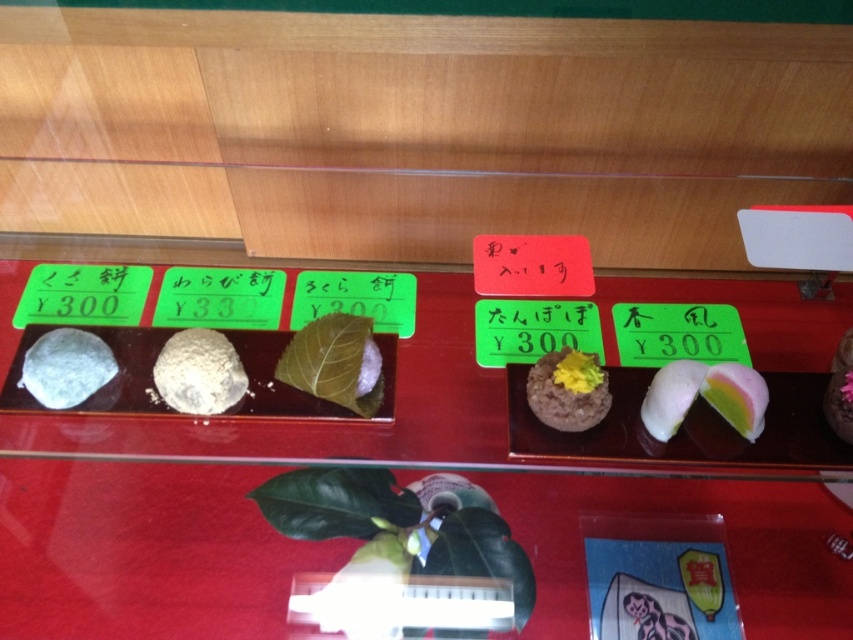
Question: Considering the relative positions of matte gray stone at left and smooth brown rice cake with yellow topping at center in the image provided, where is matte gray stone at left located with respect to smooth brown rice cake with yellow topping at center?

Choices:
 (A) below
 (B) above

Answer: (B)

Question: Which point is farther from the camera taking this photo?

Choices:
 (A) (184, 410)
 (B) (654, 436)
 (C) (572, 364)
 (D) (294, 362)

Answer: (B)

Question: Considering the relative positions of transparent glass tray at center and green leafy wrap at center in the image provided, where is transparent glass tray at center located with respect to green leafy wrap at center?

Choices:
 (A) above
 (B) below

Answer: (B)

Question: Which object is the closest to the pastel rainbow sponge cake at center right?

Choices:
 (A) white matte rice ball at center
 (B) matte gray stone at left
 (C) smooth pink cake at center

Answer: (C)

Question: Is white matte rice ball at center bigger than matte gray stone at left?

Choices:
 (A) no
 (B) yes

Answer: (B)

Question: Considering the real-world distances, which object is farthest from the transparent glass tray at center?

Choices:
 (A) pastel rainbow sponge cake at center right
 (B) smooth pink cake at center
 (C) smooth brown rice cake with yellow topping at center
 (D) matte gray stone at left

Answer: (B)